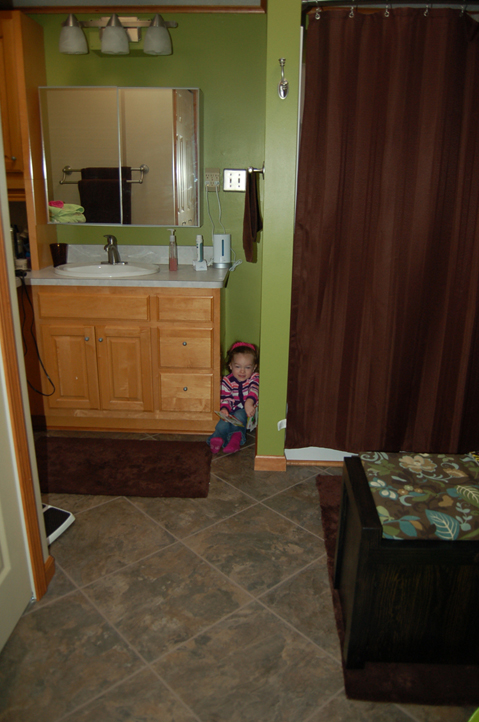
Where is `shower curtain`? Image resolution: width=479 pixels, height=722 pixels. shower curtain is located at coordinates (357, 282).